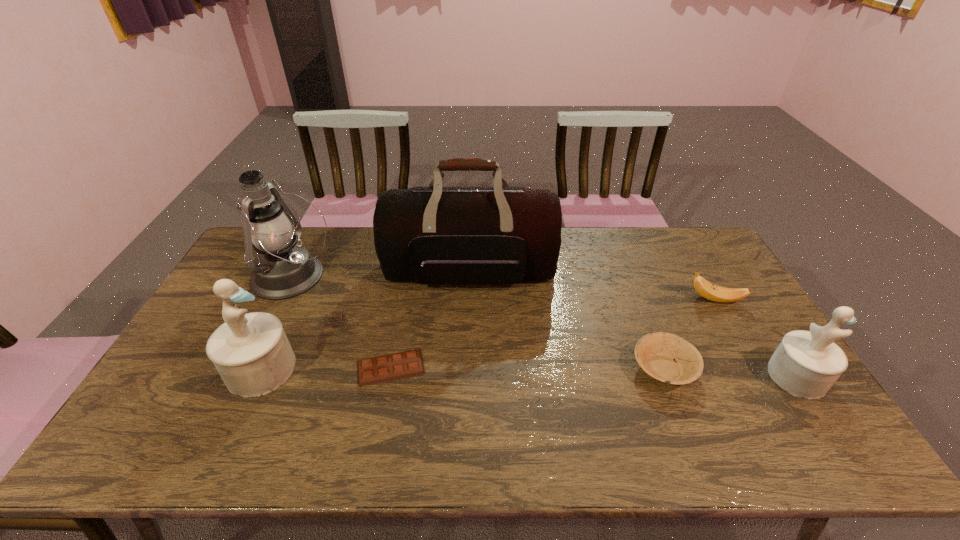
Locate an element on the screen. vacant space at the far right corner of the desktop is located at coordinates (720, 267).

At what (x,y) coordinates should I click in order to perform the action: click on free space between the right figurine and the shortest object. Please return your answer as a coordinate pair (x, y). Image resolution: width=960 pixels, height=540 pixels. Looking at the image, I should click on (593, 372).

This screenshot has width=960, height=540. Identify the location of vacant region between the taller figurine and the right figurine. (529, 373).

In order to click on free space between the duffel bag and the banana in this screenshot , I will do `click(592, 285)`.

Identify the location of vacant region between the third shortest object and the oil lamp. (x=504, y=288).

This screenshot has width=960, height=540. Identify the location of vacant area that lies between the duffel bag and the oil lamp. (381, 274).

In order to click on vacant space in between the oil lamp and the chocolate bar in this screenshot , I will do `click(342, 322)`.

Image resolution: width=960 pixels, height=540 pixels. Find the location of `free area in between the taller figurine and the third shortest object`. free area in between the taller figurine and the third shortest object is located at coordinates pos(488,334).

Where is `vacant space that's between the third shortest object and the duffel bag`? This screenshot has height=540, width=960. vacant space that's between the third shortest object and the duffel bag is located at coordinates (592, 285).

This screenshot has height=540, width=960. Identify the location of vacant space that's between the oil lamp and the third shortest object. (504, 288).